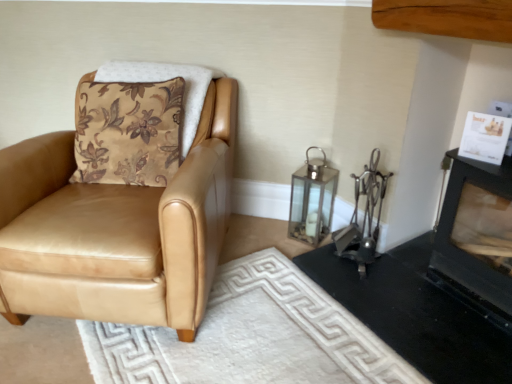
Image resolution: width=512 pixels, height=384 pixels. Find the location of `free space that is in between tan leather chair at left and white textured rug at lower center`. free space that is in between tan leather chair at left and white textured rug at lower center is located at coordinates (95, 360).